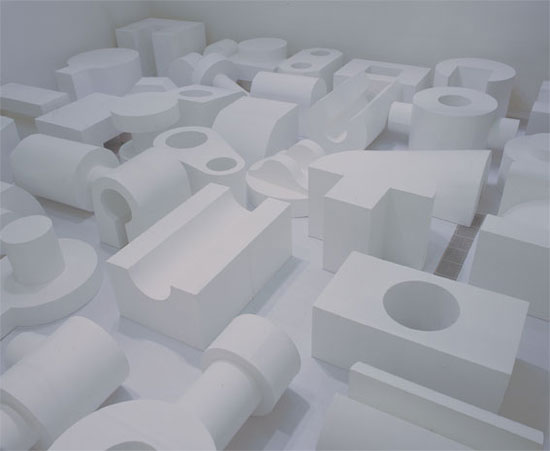
At what (x,y) coordinates should I click in order to perform the action: click on wall 2. Please return your answer as a coordinate pair (x, y). This screenshot has width=550, height=451. Looking at the image, I should click on (54, 22).